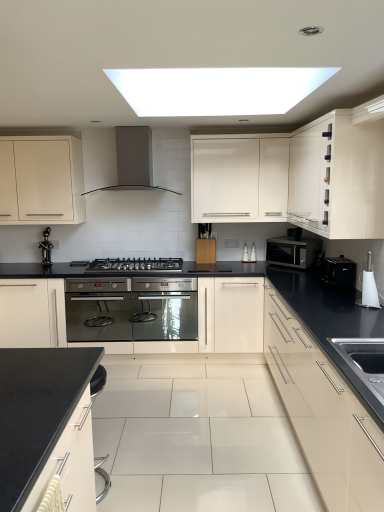
Question: Is glossy cream cabinet at right, which is counted as the 2th cabinetry, starting from the right, turned away from white glossy toilet brush at right, positioned as the 1th appliance in front-to-back order?

Choices:
 (A) yes
 (B) no

Answer: (B)

Question: Can you confirm if glossy cream cabinet at right, which is counted as the 2th cabinetry, starting from the right, is taller than white glossy toilet brush at right, placed as the 2th appliance when sorted from back to front?

Choices:
 (A) no
 (B) yes

Answer: (B)

Question: Is glossy cream cabinet at right, which is counted as the 2th cabinetry, starting from the right, bigger than white glossy toilet brush at right, placed as the 2th appliance when sorted from back to front?

Choices:
 (A) no
 (B) yes

Answer: (B)

Question: From the image's perspective, is glossy cream cabinet at right, which is counted as the 2th cabinetry, starting from the right, located above white glossy toilet brush at right, positioned as the 1th appliance in front-to-back order?

Choices:
 (A) yes
 (B) no

Answer: (B)

Question: From the image's perspective, is glossy cream cabinet at right, which is counted as the 2th cabinetry, starting from the right, beneath white glossy toilet brush at right, positioned as the 1th appliance in front-to-back order?

Choices:
 (A) no
 (B) yes

Answer: (B)

Question: From a real-world perspective, is black matte faucet at left positioned above or below white glossy cabinet at upper right, which is the 1th cabinetry from right to left?

Choices:
 (A) below
 (B) above

Answer: (A)

Question: Looking at the image, does black matte faucet at left seem bigger or smaller compared to white glossy cabinet at upper right, arranged as the fifth cabinetry when viewed from the left?

Choices:
 (A) small
 (B) big

Answer: (A)

Question: Considering the positions of black matte faucet at left and white glossy cabinet at upper right, arranged as the fifth cabinetry when viewed from the left, in the image, is black matte faucet at left taller or shorter than white glossy cabinet at upper right, arranged as the fifth cabinetry when viewed from the left,?

Choices:
 (A) tall
 (B) short

Answer: (B)

Question: Choose the correct answer: Is black matte faucet at left inside white glossy cabinet at upper right, which is the 1th cabinetry from right to left, or outside it?

Choices:
 (A) inside
 (B) outside

Answer: (B)

Question: Looking at their shapes, would you say white glossy cabinet at upper center, the third cabinetry in the left-to-right sequence, is wider or thinner than glossy cream cabinet at right, which is counted as the 2th cabinetry, starting from the right?

Choices:
 (A) thin
 (B) wide

Answer: (A)

Question: In terms of height, does white glossy cabinet at upper center, the third cabinetry in the right-to-left sequence, look taller or shorter compared to glossy cream cabinet at right, which is counted as the 2th cabinetry, starting from the right?

Choices:
 (A) short
 (B) tall

Answer: (A)

Question: Does point (284, 159) appear closer or farther from the camera than point (286, 411)?

Choices:
 (A) farther
 (B) closer

Answer: (A)

Question: Considering the positions of white glossy cabinet at upper center, the third cabinetry in the right-to-left sequence, and glossy cream cabinet at right, the 4th cabinetry when ordered from left to right, in the image, is white glossy cabinet at upper center, the third cabinetry in the right-to-left sequence, bigger or smaller than glossy cream cabinet at right, the 4th cabinetry when ordered from left to right,?

Choices:
 (A) small
 (B) big

Answer: (A)

Question: From a real-world perspective, is white glossy toilet brush at right, positioned as the 1th appliance in front-to-back order, physically located above or below black matte countertop at lower left, acting as the 4th cabinetry starting from the right?

Choices:
 (A) below
 (B) above

Answer: (B)

Question: In terms of height, does white glossy toilet brush at right, positioned as the 1th appliance in front-to-back order, look taller or shorter compared to black matte countertop at lower left, acting as the 4th cabinetry starting from the right?

Choices:
 (A) short
 (B) tall

Answer: (A)